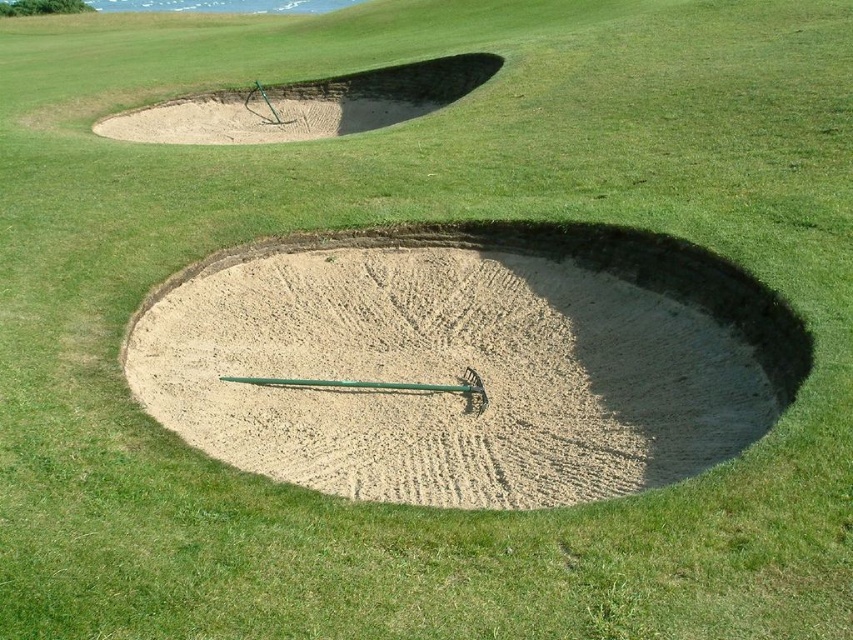
Question: Which object appears farthest from the camera in this image?

Choices:
 (A) smooth sand rake at center
 (B) smooth sand trap at upper left

Answer: (B)

Question: Where is smooth sand rake at center located in relation to smooth sand trap at upper left in the image?

Choices:
 (A) right
 (B) left

Answer: (A)

Question: Is smooth sand rake at center thinner than smooth sand trap at upper left?

Choices:
 (A) yes
 (B) no

Answer: (A)

Question: Is smooth sand rake at center to the right of smooth sand trap at upper left from the viewer's perspective?

Choices:
 (A) no
 (B) yes

Answer: (B)

Question: Among these points, which one is farthest from the camera?

Choices:
 (A) (431, 106)
 (B) (270, 346)

Answer: (A)